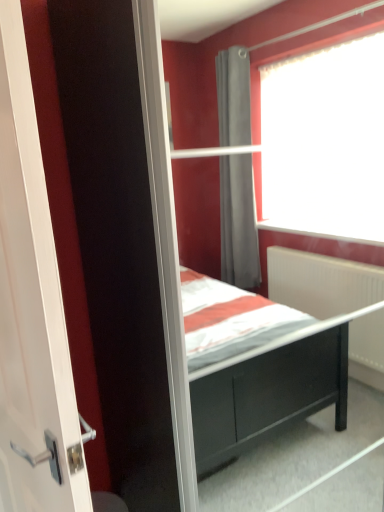
What do you see at coordinates (31, 310) in the screenshot? I see `white glossy door at left` at bounding box center [31, 310].

The image size is (384, 512). Identify the location of white glossy door at left. (31, 310).

This screenshot has width=384, height=512. What are the coordinates of `white glossy door at left` in the screenshot? It's located at (31, 310).